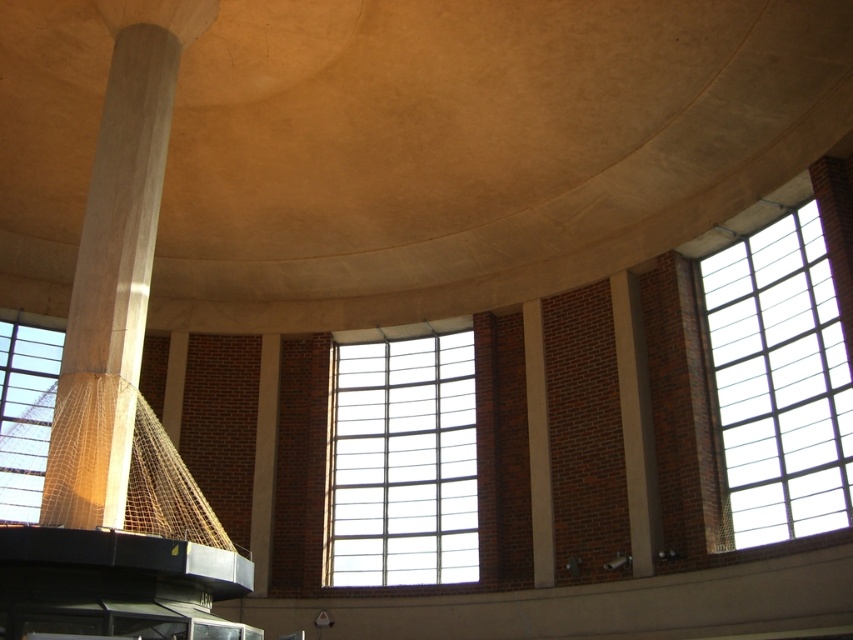
Locate an element on the screen. The height and width of the screenshot is (640, 853). clear glass window at left is located at coordinates (25, 416).

Is clear glass window at left to the left of white concrete beam at center from the viewer's perspective?

Correct, you'll find clear glass window at left to the left of white concrete beam at center.

Locate an element on the screen. This screenshot has width=853, height=640. clear glass window at left is located at coordinates (25, 416).

Identify the location of clear glass window at left. This screenshot has width=853, height=640. (25, 416).

Does point (811, 435) come in front of point (398, 346)?

Yes.

Which is more to the left, clear glass window at right or clear glass window at center?

From the viewer's perspective, clear glass window at center appears more on the left side.

Identify the location of clear glass window at right. (779, 384).

From the picture: Between smooth concrete pillar at left and clear glass window at right, which one appears on the right side from the viewer's perspective?

From the viewer's perspective, clear glass window at right appears more on the right side.

Can you confirm if smooth concrete pillar at left is shorter than clear glass window at right?

No, smooth concrete pillar at left is not shorter than clear glass window at right.

Is point (91, 268) positioned before point (793, 400)?

Yes.

Identify the location of smooth concrete pillar at left. This screenshot has width=853, height=640. (115, 264).